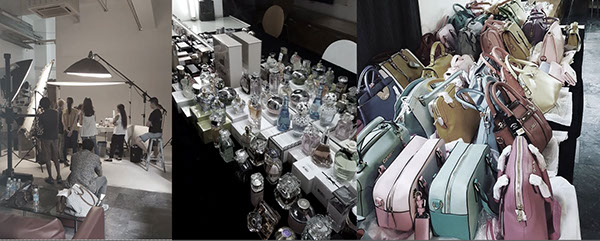
This screenshot has width=600, height=241. I want to click on overhead light, so 95,66.